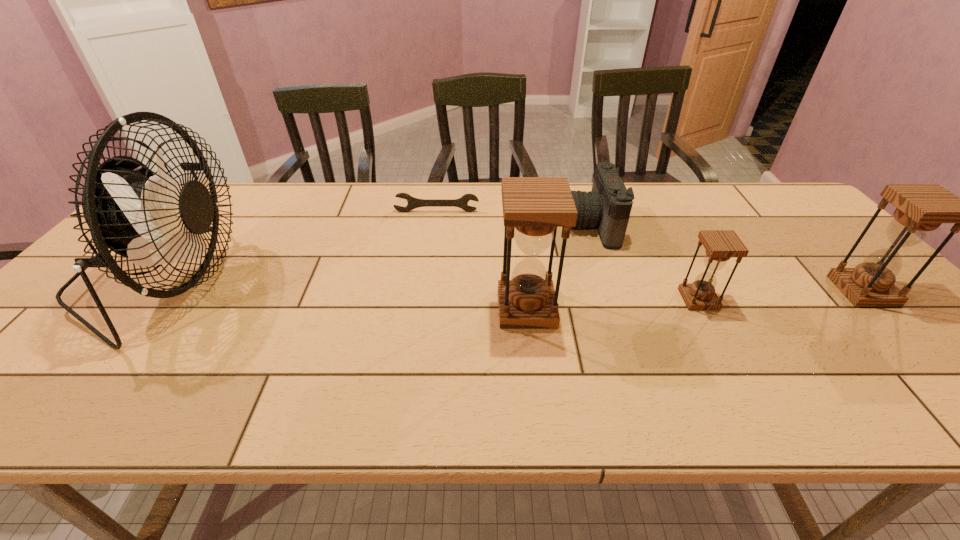
The height and width of the screenshot is (540, 960). I want to click on vacant region located on the left of the third object from left to right, so click(466, 308).

Identify the location of free space located on the left of the second hourglass from right to left. The width and height of the screenshot is (960, 540). click(x=597, y=299).

This screenshot has height=540, width=960. I want to click on free space located 0.370m on the left of the second tallest hourglass, so click(692, 291).

The width and height of the screenshot is (960, 540). Find the location of `vacant position located 0.290m at the lens of the fourth object from left to right`. vacant position located 0.290m at the lens of the fourth object from left to right is located at coordinates (471, 225).

Find the location of a particular element. The image size is (960, 540). free space located at the lens of the fourth object from left to right is located at coordinates (551, 225).

Where is `vacant space located at the lens of the fourth object from left to right`? vacant space located at the lens of the fourth object from left to right is located at coordinates [538, 225].

Locate an element on the screen. This screenshot has height=540, width=960. free space located 0.270m in front of the fan, directing airflow is located at coordinates (340, 281).

Locate an element on the screen. This screenshot has width=960, height=540. free space located on the open ends of the shortest object is located at coordinates (432, 243).

At what (x,y) coordinates should I click in order to perform the action: click on camera positioned at the far edge. Please return your answer as a coordinate pair (x, y). Looking at the image, I should click on (608, 205).

In order to click on wrench that is at the far edge in this screenshot , I will do `click(413, 203)`.